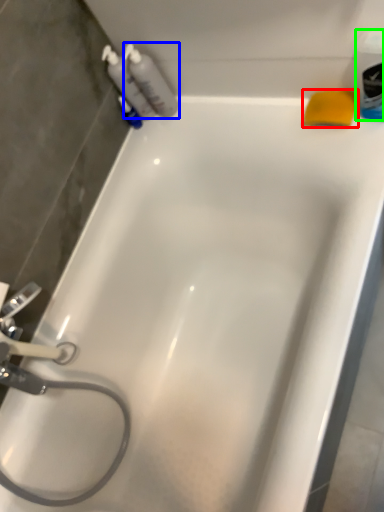
Question: Based on their relative distances, which object is nearer to soap (highlighted by a red box)? Choose from cleaning product (highlighted by a blue box) and mouthwash (highlighted by a green box).

Choices:
 (A) cleaning product
 (B) mouthwash

Answer: (B)